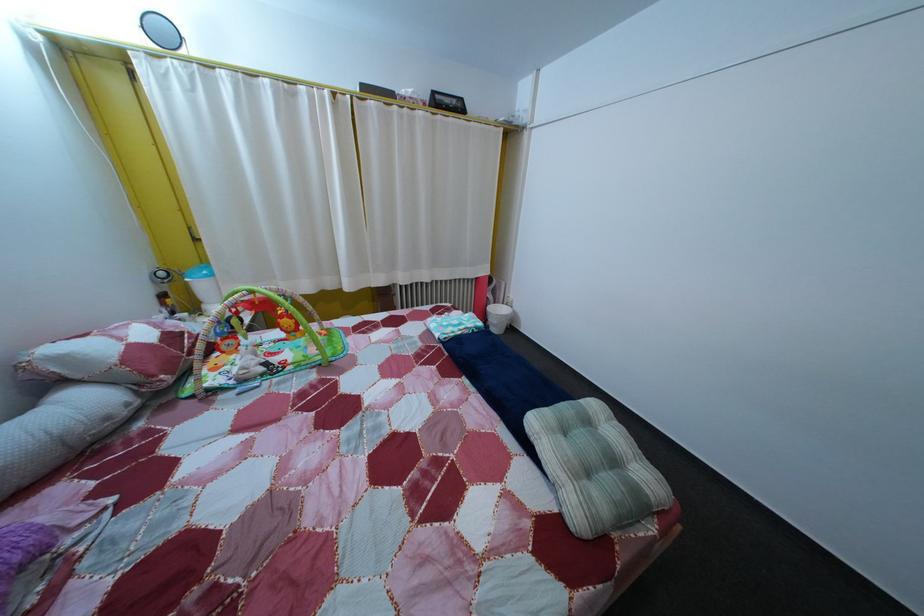
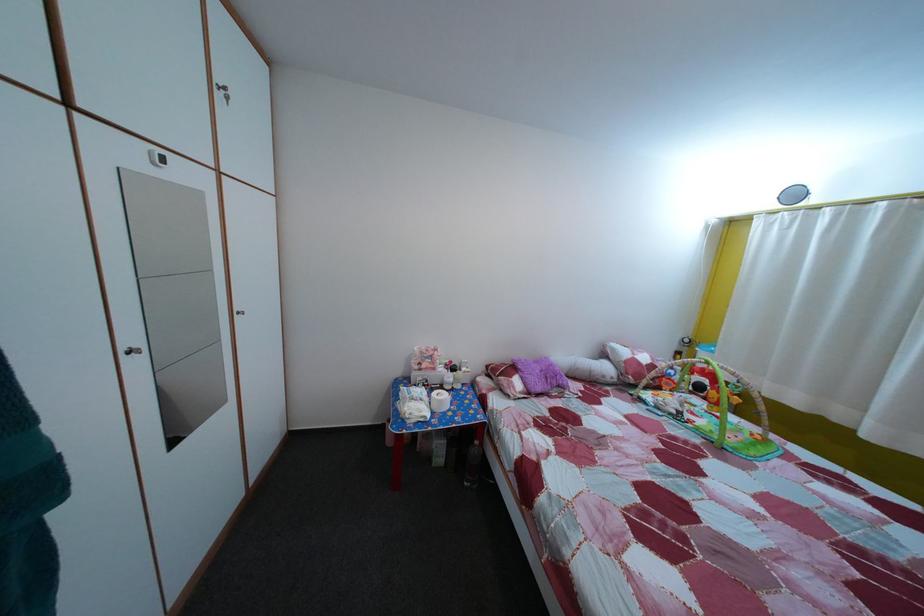
Question: The images are taken continuously from a first-person perspective. In which direction is your viewpoint rotating?

Choices:
 (A) Left
 (B) Right
 (C) Up
 (D) Down

Answer: (A)